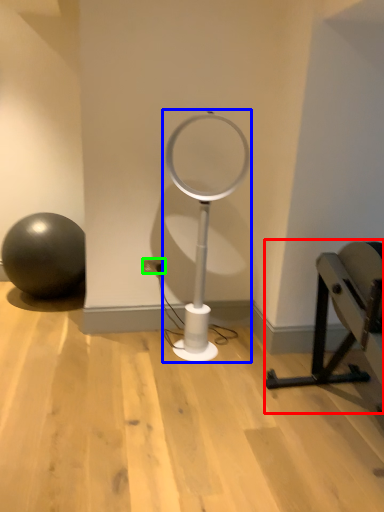
Question: Based on their relative distances, which object is nearer to furniture (highlighted by a red box)? Choose from table lamp (highlighted by a blue box) and electric outlet (highlighted by a green box).

Choices:
 (A) table lamp
 (B) electric outlet

Answer: (A)